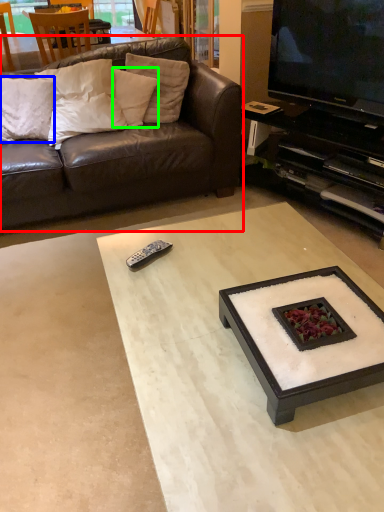
Question: Estimate the real-world distances between objects in this image. Which object is farther from studio couch (highlighted by a red box), pillow (highlighted by a blue box) or pillow (highlighted by a green box)?

Choices:
 (A) pillow
 (B) pillow

Answer: (A)